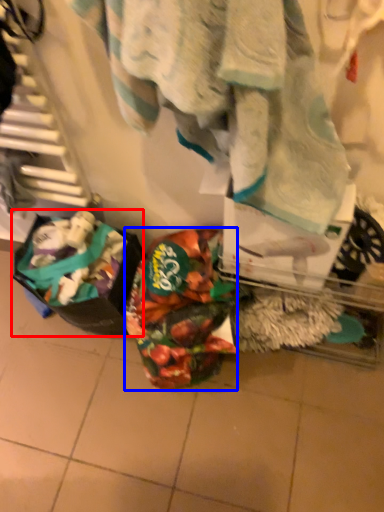
Question: Which object appears closest to the camera in this image, waste (highlighted by a red box) or waste (highlighted by a blue box)?

Choices:
 (A) waste
 (B) waste

Answer: (A)